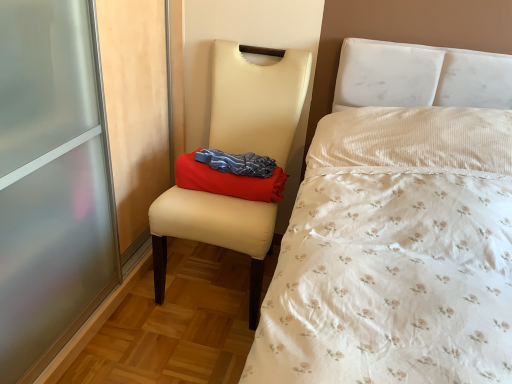
Question: From a real-world perspective, does red fabric pillow at center sit lower than matte cream chair at center?

Choices:
 (A) no
 (B) yes

Answer: (A)

Question: Is red fabric pillow at center wider than matte cream chair at center?

Choices:
 (A) no
 (B) yes

Answer: (A)

Question: Is red fabric pillow at center at the right side of matte cream chair at center?

Choices:
 (A) no
 (B) yes

Answer: (B)

Question: Does red fabric pillow at center have a lesser height compared to matte cream chair at center?

Choices:
 (A) no
 (B) yes

Answer: (B)

Question: Is red fabric pillow at center next to matte cream chair at center?

Choices:
 (A) no
 (B) yes

Answer: (A)

Question: Does red fabric pillow at center have a lesser width compared to matte cream chair at center?

Choices:
 (A) no
 (B) yes

Answer: (B)

Question: Can you confirm if matte cream chair at center is positioned to the left of red fabric pillow at center?

Choices:
 (A) no
 (B) yes

Answer: (B)

Question: Can you see matte cream chair at center touching red fabric pillow at center?

Choices:
 (A) yes
 (B) no

Answer: (B)

Question: Is matte cream chair at center oriented towards red fabric pillow at center?

Choices:
 (A) yes
 (B) no

Answer: (A)

Question: Is matte cream chair at center looking in the opposite direction of red fabric pillow at center?

Choices:
 (A) no
 (B) yes

Answer: (B)

Question: Is matte cream chair at center positioned beyond the bounds of red fabric pillow at center?

Choices:
 (A) no
 (B) yes

Answer: (B)

Question: Is matte cream chair at center smaller than red fabric pillow at center?

Choices:
 (A) yes
 (B) no

Answer: (B)

Question: Considering the positions of matte cream chair at center and red fabric pillow at center in the image, is matte cream chair at center taller or shorter than red fabric pillow at center?

Choices:
 (A) tall
 (B) short

Answer: (A)